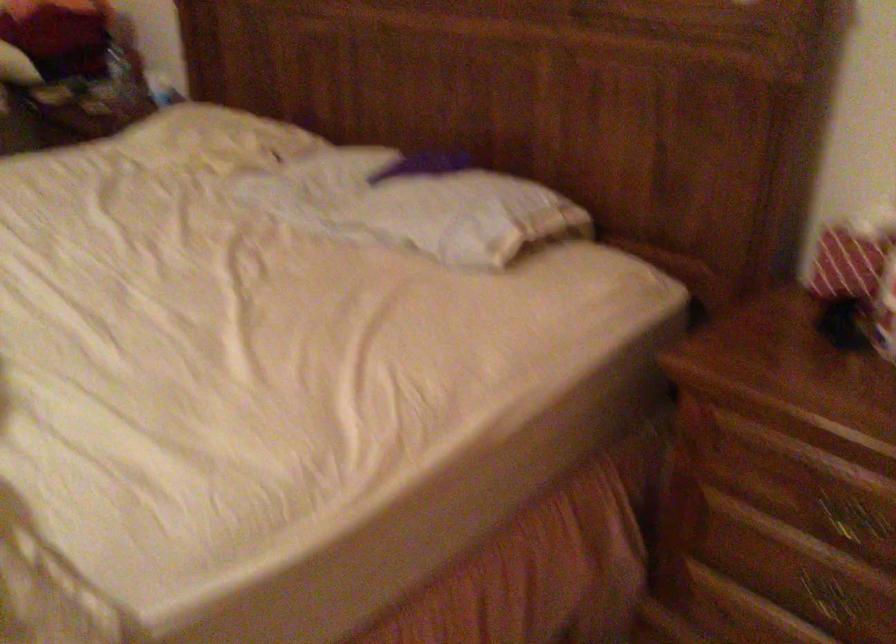
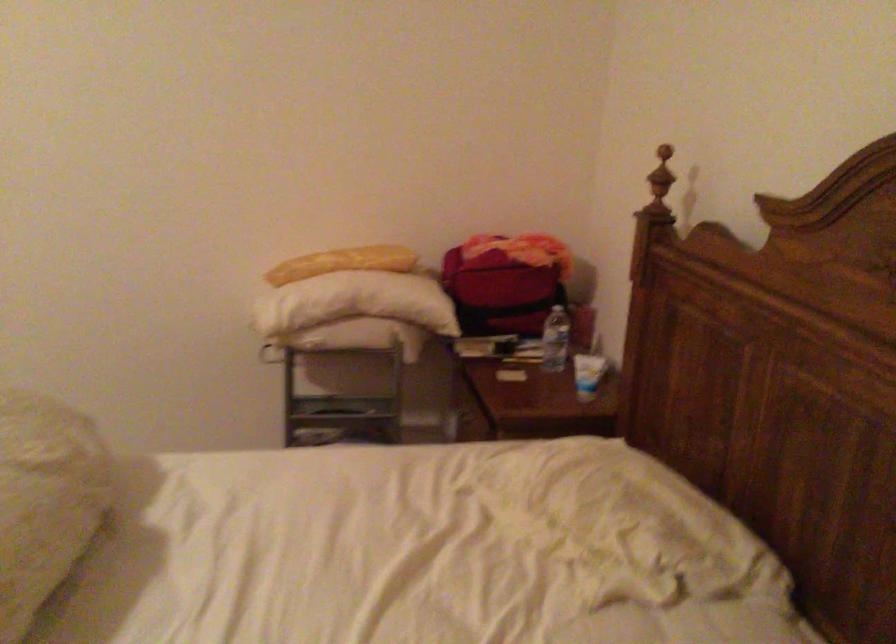
Question: The camera is either moving clockwise (left) or counter-clockwise (right) around the object. The first image is from the beginning of the video and the second image is from the end. Is the camera moving left or right when shooting the video?

Choices:
 (A) Left
 (B) Right

Answer: (B)